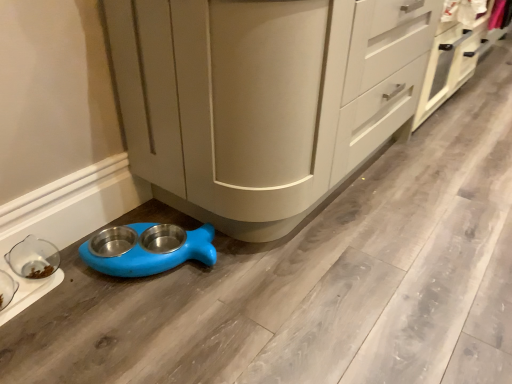
Question: Does white matte cabinet at center, which is counted as the second cabinetry, starting from the left, come behind blue plastic pet feeder at lower left, the 1th appliance positioned from the right?

Choices:
 (A) yes
 (B) no

Answer: (A)

Question: From a real-world perspective, is white matte cabinet at center, the 1th cabinetry when ordered from right to left, physically below blue plastic pet feeder at lower left, the 1th appliance positioned from the right?

Choices:
 (A) no
 (B) yes

Answer: (A)

Question: Is white matte cabinet at center, which is counted as the second cabinetry, starting from the left, outside blue plastic pet feeder at lower left, which is the 2th appliance from left to right?

Choices:
 (A) yes
 (B) no

Answer: (A)

Question: From the image's perspective, is white matte cabinet at center, which is counted as the second cabinetry, starting from the left, above blue plastic pet feeder at lower left, the 1th appliance positioned from the right?

Choices:
 (A) yes
 (B) no

Answer: (A)

Question: Can you confirm if white matte cabinet at center, the 1th cabinetry when ordered from right to left, is shorter than blue plastic pet feeder at lower left, which is the 2th appliance from left to right?

Choices:
 (A) no
 (B) yes

Answer: (A)

Question: Is white matte cabinet at center, the 1th cabinetry when ordered from right to left, turned away from blue plastic pet feeder at lower left, the 1th appliance positioned from the right?

Choices:
 (A) no
 (B) yes

Answer: (A)

Question: Is transparent glass bowl at lower left, which is the first appliance from left to right, further to camera compared to white matte cabinet at center, which is counted as the second cabinetry, starting from the left?

Choices:
 (A) no
 (B) yes

Answer: (A)

Question: Considering the relative sizes of transparent glass bowl at lower left, placed as the second appliance when sorted from right to left, and white matte cabinet at center, the 1th cabinetry when ordered from right to left, in the image provided, is transparent glass bowl at lower left, placed as the second appliance when sorted from right to left, bigger than white matte cabinet at center, the 1th cabinetry when ordered from right to left,?

Choices:
 (A) no
 (B) yes

Answer: (A)

Question: From a real-world perspective, does transparent glass bowl at lower left, which is the first appliance from left to right, sit lower than white matte cabinet at center, the 1th cabinetry when ordered from right to left?

Choices:
 (A) yes
 (B) no

Answer: (A)

Question: Is transparent glass bowl at lower left, placed as the second appliance when sorted from right to left, not within white matte cabinet at center, which is counted as the second cabinetry, starting from the left?

Choices:
 (A) no
 (B) yes

Answer: (B)

Question: Does transparent glass bowl at lower left, which is the first appliance from left to right, come in front of white matte cabinet at center, the 1th cabinetry when ordered from right to left?

Choices:
 (A) yes
 (B) no

Answer: (A)

Question: Is transparent glass bowl at lower left, placed as the second appliance when sorted from right to left, positioned with its back to white matte cabinet at center, which is counted as the second cabinetry, starting from the left?

Choices:
 (A) yes
 (B) no

Answer: (B)

Question: Is blue plastic pet feeder at lower left, which is the 2th appliance from left to right, bigger than matte beige cabinet at lower center, the first cabinetry in the left-to-right sequence?

Choices:
 (A) no
 (B) yes

Answer: (A)